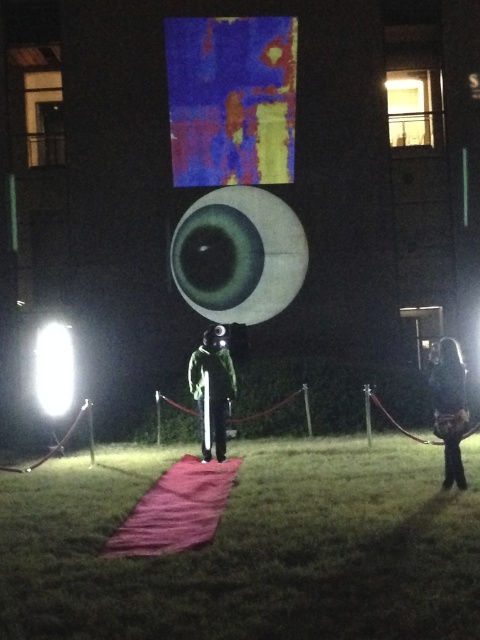
Can you confirm if green grass at center is positioned to the left of white glossy light at left?

In fact, green grass at center is to the right of white glossy light at left.

Is green grass at center to the right of white glossy light at left from the viewer's perspective?

Correct, you'll find green grass at center to the right of white glossy light at left.

Is point (272, 627) farther from viewer compared to point (44, 326)?

No, (272, 627) is closer to viewer.

At what (x,y) coordinates should I click in order to perform the action: click on green grass at center. Please return your answer as a coordinate pair (x, y). The width and height of the screenshot is (480, 640). Looking at the image, I should click on (251, 548).

Between green grass at center and dark fabric coat at lower right, which one appears on the right side from the viewer's perspective?

dark fabric coat at lower right

Where is `green grass at center`? This screenshot has width=480, height=640. green grass at center is located at coordinates (251, 548).

Does point (444, 524) come closer to viewer compared to point (448, 352)?

Yes, it is in front of point (448, 352).

The height and width of the screenshot is (640, 480). I want to click on green grass at center, so click(x=251, y=548).

Where is `dark fabric coat at lower right`? The width and height of the screenshot is (480, 640). dark fabric coat at lower right is located at coordinates (450, 406).

Which is behind, point (440, 419) or point (68, 356)?

Positioned behind is point (68, 356).

Is point (448, 417) closer to camera compared to point (50, 328)?

Yes, it is.

This screenshot has width=480, height=640. Identify the location of dark fabric coat at lower right. (450, 406).